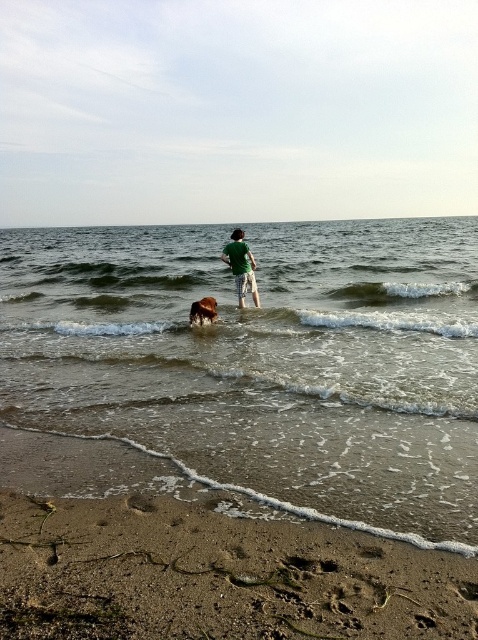
Consider the image. You are standing on the beach and see the clear water at center and the brown furry dog at center. Which object is closer to your right side?

The clear water at center is to the right of brown furry dog at center, so the clear water at center is closer to your right side.

You are standing on the brown sandy beach at lower left and want to reach the brown furry dog at center. Which direction should you move to get closer to the dog?

Since the brown sandy beach at lower left is to the right of the brown furry dog at center, you should move to your left to approach the dog.